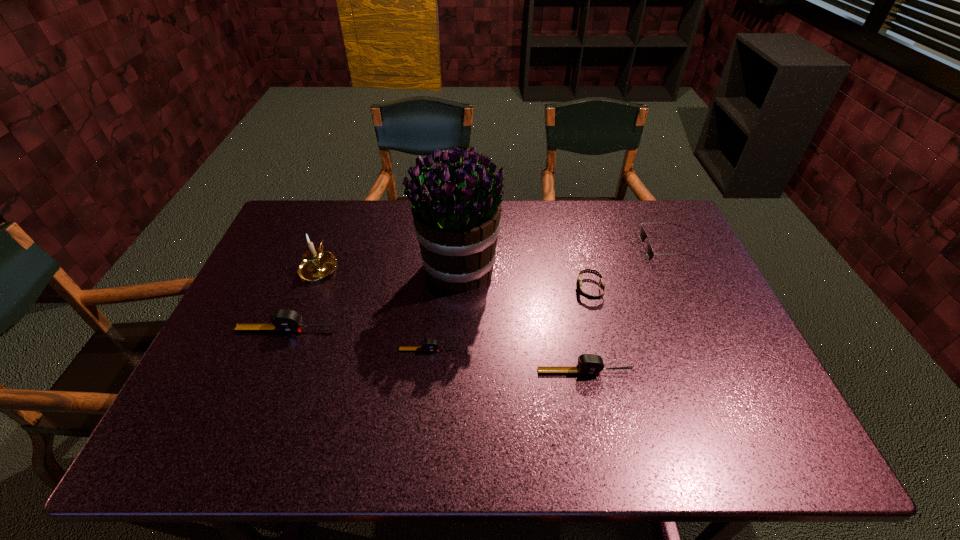
This screenshot has width=960, height=540. I want to click on free space for a new tape measure on the right, so click(755, 396).